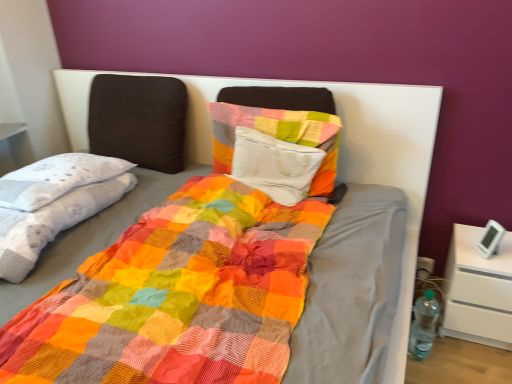
This screenshot has width=512, height=384. Describe the element at coordinates (478, 290) in the screenshot. I see `white matte nightstand at lower right` at that location.

You are a GUI agent. You are given a task and a screenshot of the screen. Output one action in this format:
    pyautogui.click(x=<x>, y=<y>)
    Task: Click on the white matte nightstand at lower right
    This screenshot has height=384, width=512.
    Given the screenshot: What is the action you would take?
    pyautogui.click(x=478, y=290)

Find the location of a particular element. This screenshot has height=384, width=512. textured cotton pillow at center is located at coordinates (x=277, y=135).

The image size is (512, 384). I want to click on white matte nightstand at lower right, so click(478, 290).

Which object is positioned more to the left, textured cotton pillow at center or white matte nightstand at lower right?

textured cotton pillow at center is more to the left.

Is textured cotton pillow at center far from white matte nightstand at lower right?

textured cotton pillow at center is near white matte nightstand at lower right, not far away.

Does textured cotton pillow at center turn towards white matte nightstand at lower right?

No, textured cotton pillow at center is not aimed at white matte nightstand at lower right.

From a real-world perspective, is textured cotton pillow at center positioned over white matte nightstand at lower right based on gravity?

Yes, from a real-world perspective, textured cotton pillow at center is above white matte nightstand at lower right.

Could you tell me if clear plastic bottle at right is turned towards multicolored patchwork blanket at left?

No, clear plastic bottle at right is not turned towards multicolored patchwork blanket at left.

What's the angular difference between clear plastic bottle at right and multicolored patchwork blanket at left's facing directions?

15 degrees separate the facing orientations of clear plastic bottle at right and multicolored patchwork blanket at left.

Where is `bottle that is under the multicolored patchwork blanket at left (from a real-world perspective)`? bottle that is under the multicolored patchwork blanket at left (from a real-world perspective) is located at coordinates (423, 325).

Can you confirm if clear plastic bottle at right is positioned to the right of multicolored patchwork blanket at left?

Indeed, clear plastic bottle at right is positioned on the right side of multicolored patchwork blanket at left.

Between multicolored patchwork blanket at left and textured cotton pillow at center, which one has less height?

multicolored patchwork blanket at left is shorter.

Is point (17, 277) positioned before point (326, 166)?

Yes, point (17, 277) is in front of point (326, 166).

In the image, is multicolored patchwork blanket at left on the left side or the right side of textured cotton pillow at center?

Based on their positions, multicolored patchwork blanket at left is located to the left of textured cotton pillow at center.

Would you say textured cotton pillow at center is part of multicolored patchwork blanket at left's contents?

No, textured cotton pillow at center is located outside of multicolored patchwork blanket at left.

Does multicolored patchwork blanket at left turn towards clear plastic bottle at right?

No, multicolored patchwork blanket at left is not oriented towards clear plastic bottle at right.

Which of these two, multicolored patchwork blanket at left or clear plastic bottle at right, is bigger?

Bigger between the two is multicolored patchwork blanket at left.

Based on the photo, is multicolored patchwork blanket at left closer to the viewer compared to clear plastic bottle at right?

Yes, it is in front of clear plastic bottle at right.

Is multicolored patchwork blanket at left outside of clear plastic bottle at right?

Yes, multicolored patchwork blanket at left is located beyond the bounds of clear plastic bottle at right.

Is textured cotton pillow at center smaller than clear plastic bottle at right?

Incorrect, textured cotton pillow at center is not smaller in size than clear plastic bottle at right.

Does point (325, 141) appear closer or farther from the camera than point (417, 310)?

Point (325, 141) appears to be closer to the viewer than point (417, 310).

How much distance is there between textured cotton pillow at center and clear plastic bottle at right?

They are 92.11 centimeters apart.

Between textured cotton pillow at center and clear plastic bottle at right, which one has less height?

clear plastic bottle at right.

From the image's perspective, which one is positioned lower, clear plastic bottle at right or textured cotton pillow at center?

clear plastic bottle at right appears lower in the image.

How much distance is there between clear plastic bottle at right and textured cotton pillow at center?

The distance of clear plastic bottle at right from textured cotton pillow at center is 92.11 centimeters.

Considering the positions of objects clear plastic bottle at right and textured cotton pillow at center in the image provided, who is more to the right, clear plastic bottle at right or textured cotton pillow at center?

clear plastic bottle at right.

From a real-world perspective, is clear plastic bottle at right over textured cotton pillow at center?

Incorrect, from a real-world perspective, clear plastic bottle at right is lower than textured cotton pillow at center.

Does white matte nightstand at lower right have a larger size compared to textured cotton pillow at center?

Indeed, white matte nightstand at lower right has a larger size compared to textured cotton pillow at center.

Between white matte nightstand at lower right and textured cotton pillow at center, which one has larger width?

Wider between the two is white matte nightstand at lower right.

This screenshot has width=512, height=384. I want to click on nightstand located underneath the textured cotton pillow at center (from a real-world perspective), so click(478, 290).

From a real-world perspective, is white matte nightstand at lower right positioned above or below textured cotton pillow at center?

white matte nightstand at lower right is situated lower than textured cotton pillow at center in the real world.

Locate an element on the screen. pillow above the white matte nightstand at lower right (from the image's perspective) is located at coordinates (277, 135).

I want to click on bottle behind the multicolored patchwork blanket at left, so click(x=423, y=325).

Based on their spatial positions, is multicolored patchwork blanket at left or textured cotton pillow at center further from white matte nightstand at lower right?

Based on the image, multicolored patchwork blanket at left appears to be further to white matte nightstand at lower right.

Considering their positions, is clear plastic bottle at right positioned closer to multicolored patchwork blanket at left than textured cotton pillow at center?

The object closer to multicolored patchwork blanket at left is textured cotton pillow at center.

Estimate the real-world distances between objects in this image. Which object is further from clear plastic bottle at right, white matte nightstand at lower right or textured cotton pillow at center?

textured cotton pillow at center.

From the picture: When comparing their distances from multicolored patchwork blanket at left, does clear plastic bottle at right or white matte nightstand at lower right seem closer?

clear plastic bottle at right.

From the image, which object appears to be farther from multicolored patchwork blanket at left, white matte nightstand at lower right or textured cotton pillow at center?

The object further to multicolored patchwork blanket at left is white matte nightstand at lower right.

From the image, which object appears to be farther from textured cotton pillow at center, white matte nightstand at lower right or multicolored patchwork blanket at left?

Among the two, white matte nightstand at lower right is located further to textured cotton pillow at center.

Based on their spatial positions, is clear plastic bottle at right or multicolored patchwork blanket at left further from white matte nightstand at lower right?

Based on the image, multicolored patchwork blanket at left appears to be further to white matte nightstand at lower right.

Which object lies further to the anchor point textured cotton pillow at center, clear plastic bottle at right or multicolored patchwork blanket at left?

clear plastic bottle at right.

Where is `bottle between textured cotton pillow at center and white matte nightstand at lower right in the horizontal direction`? bottle between textured cotton pillow at center and white matte nightstand at lower right in the horizontal direction is located at coordinates (423, 325).

You are a GUI agent. You are given a task and a screenshot of the screen. Output one action in this format:
    pyautogui.click(x=<x>, y=<y>)
    Task: Click on the pillow located between multicolored patchwork blanket at left and white matte nightstand at lower right in the left-right direction
    The width and height of the screenshot is (512, 384).
    Given the screenshot: What is the action you would take?
    pyautogui.click(x=277, y=135)

Identify the location of bottle between multicolored patchwork blanket at left and white matte nightstand at lower right from left to right. Image resolution: width=512 pixels, height=384 pixels. (423, 325).

I want to click on pillow located between multicolored patchwork blanket at left and clear plastic bottle at right in the left-right direction, so click(x=277, y=135).